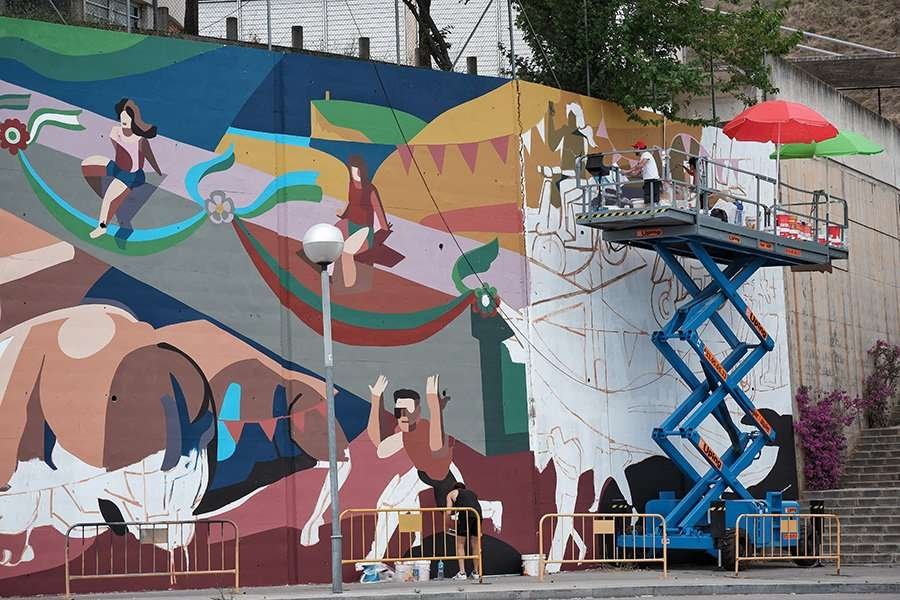
You are a GUI agent. You are given a task and a screenshot of the screen. Output one action in this format:
    pyautogui.click(x=<x>, y=<y>)
    Task: Click on the tan paint
    
    Given the screenshot: What is the action you would take?
    pyautogui.click(x=86, y=418)